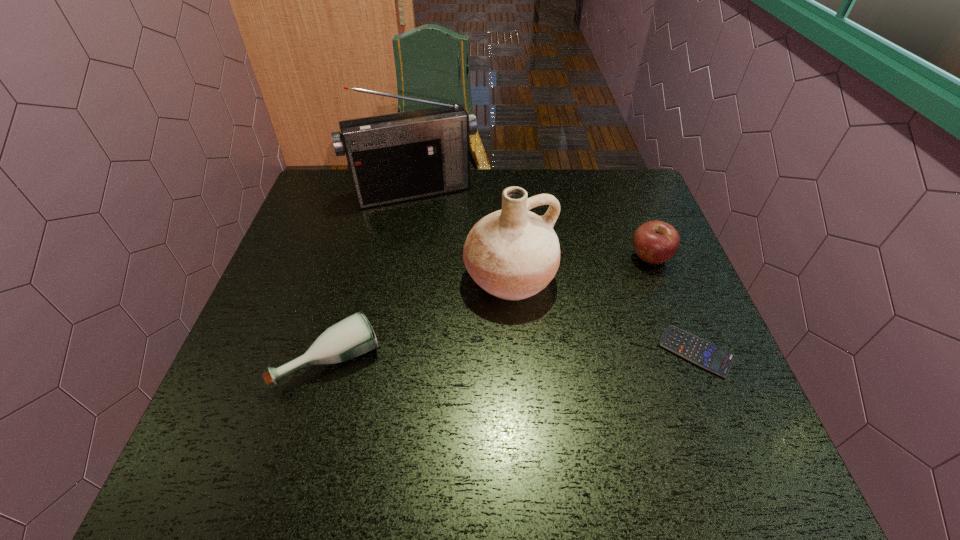
At what (x,y) coordinates should I click in order to perform the action: click on radio receiver situated at the left edge. Please return your answer as a coordinate pair (x, y). The image size is (960, 540). Looking at the image, I should click on tap(396, 157).

Locate an element on the screen. calculator that is at the right edge is located at coordinates (698, 351).

This screenshot has width=960, height=540. Find the location of `apple located in the right edge section of the desktop`. apple located in the right edge section of the desktop is located at coordinates (655, 242).

Where is `object at the far left corner`? The height and width of the screenshot is (540, 960). object at the far left corner is located at coordinates (396, 157).

This screenshot has width=960, height=540. I want to click on object at the near left corner, so click(353, 336).

The image size is (960, 540). What are the coordinates of `free spot at the far edge of the desktop` in the screenshot? It's located at (497, 197).

This screenshot has height=540, width=960. In the image, there is a desktop. Find the location of `vacant space at the near edge`. vacant space at the near edge is located at coordinates (363, 422).

The image size is (960, 540). I want to click on free spot at the left edge of the desktop, so click(344, 226).

Find the location of a particular element. vacant space at the right edge of the desktop is located at coordinates (630, 292).

In the image, there is a desktop. At what (x,y) coordinates should I click in order to perform the action: click on vacant space at the far left corner. Please return your answer as a coordinate pair (x, y). The image size is (960, 540). Looking at the image, I should click on (326, 172).